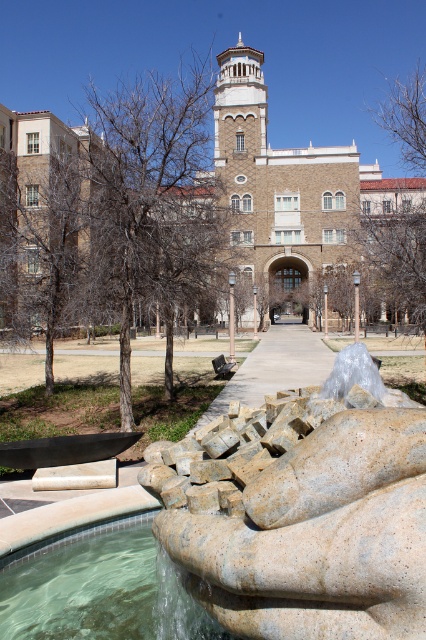
You are standing at the entrance of the large building and want to walk towards the brown textured tree at center. Which direction should you turn to first see the granite fountain at lower center?

To first see the granite fountain at lower center, you should turn to your left since the granite fountain at lower center is positioned to the left of the brown textured tree at center.

You are planning to install a new lighting system for the granite fountain at lower center and the brown textured tree at center. Since the tree is taller, you need to choose a spotlight that can reach higher. Which object requires a spotlight with a greater vertical reach?

The brown textured tree at center requires a spotlight with a greater vertical reach because it is taller than the granite fountain at lower center.

You are a landscape architect planning to install a new pathway between the granite fountain at lower center and the brown leafless tree at center. Considering their sizes, which object should the pathway be closer to?

The pathway should be closer to the granite fountain at lower center because it has a smaller size compared to the brown leafless tree at center, allowing more space around the larger tree.